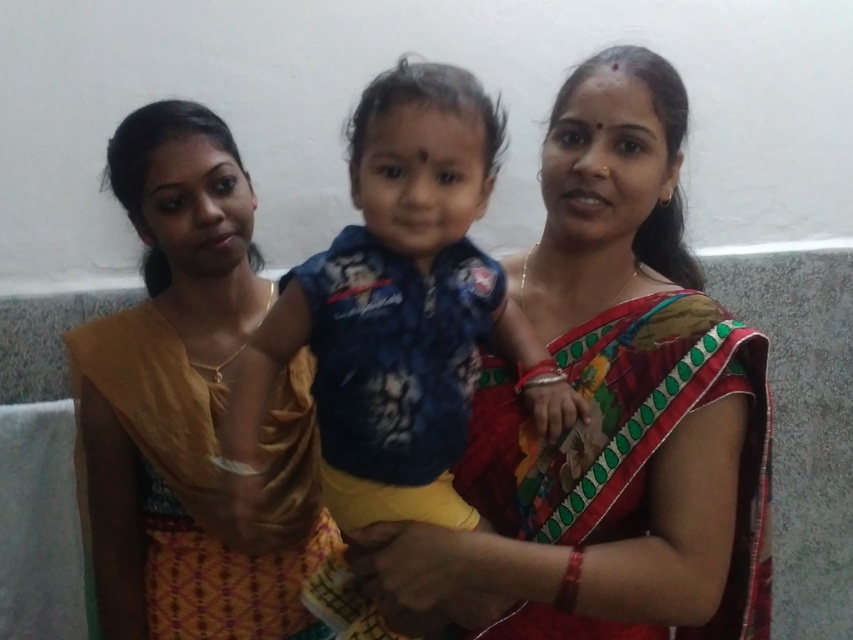
Who is more forward, [190,196] or [438,189]?

Positioned in front is point [438,189].

Which is above, matte yellow saree at left or blue cotton shirt at center?

blue cotton shirt at center is higher up.

Does point (194, 552) come closer to viewer compared to point (474, 161)?

No, it is not.

The image size is (853, 640). In order to click on matte yellow saree at left in this screenshot , I will do `click(189, 404)`.

Who is lower down, silk saree at center or matte yellow saree at left?

matte yellow saree at left is below.

Consider the image. Which is more to the right, silk saree at center or matte yellow saree at left?

From the viewer's perspective, silk saree at center appears more on the right side.

Is point (671, 493) positioned before point (294, 476)?

Yes, it is.

Identify the location of silk saree at center. (606, 412).

From the picture: Does silk saree at center have a smaller size compared to blue cotton shirt at center?

No, silk saree at center is not smaller than blue cotton shirt at center.

Based on the photo, which of these two, silk saree at center or blue cotton shirt at center, stands shorter?

blue cotton shirt at center is shorter.

Does point (550, 592) come in front of point (450, 273)?

Yes, point (550, 592) is closer to viewer.

Where is `silk saree at center`? This screenshot has width=853, height=640. silk saree at center is located at coordinates (606, 412).